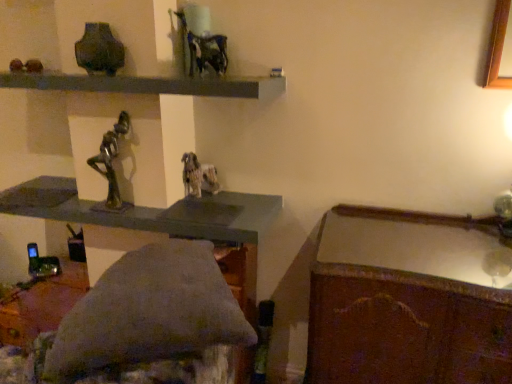
Question: Is smooth gray shelf at upper center facing towards matte dark green vase at upper left?

Choices:
 (A) yes
 (B) no

Answer: (B)

Question: Is smooth gray shelf at upper center taller than matte dark green vase at upper left?

Choices:
 (A) yes
 (B) no

Answer: (B)

Question: From the image's perspective, would you say smooth gray shelf at upper center is positioned over matte dark green vase at upper left?

Choices:
 (A) no
 (B) yes

Answer: (A)

Question: Considering the relative positions of smooth gray shelf at upper center and matte dark green vase at upper left in the image provided, is smooth gray shelf at upper center to the right of matte dark green vase at upper left from the viewer's perspective?

Choices:
 (A) no
 (B) yes

Answer: (B)

Question: Is smooth gray shelf at upper center smaller than matte dark green vase at upper left?

Choices:
 (A) yes
 (B) no

Answer: (B)

Question: Considering their positions, is smooth gray shelf at upper center located in front of or behind bronze statue at center?

Choices:
 (A) behind
 (B) front

Answer: (B)

Question: Is smooth gray shelf at upper center situated inside bronze statue at center or outside?

Choices:
 (A) inside
 (B) outside

Answer: (B)

Question: Considering the positions of point (218, 92) and point (113, 140), is point (218, 92) closer or farther from the camera than point (113, 140)?

Choices:
 (A) closer
 (B) farther

Answer: (A)

Question: From a real-world perspective, is smooth gray shelf at upper center positioned above or below bronze statue at center?

Choices:
 (A) below
 (B) above

Answer: (B)

Question: Considering the positions of point (118, 49) and point (311, 339), is point (118, 49) closer or farther from the camera than point (311, 339)?

Choices:
 (A) closer
 (B) farther

Answer: (B)

Question: Considering their positions, is matte dark green vase at upper left located in front of or behind wooden polished desk at lower right?

Choices:
 (A) front
 (B) behind

Answer: (B)

Question: Would you say matte dark green vase at upper left is to the left or to the right of wooden polished desk at lower right in the picture?

Choices:
 (A) left
 (B) right

Answer: (A)

Question: Looking at their shapes, would you say matte dark green vase at upper left is wider or thinner than wooden polished desk at lower right?

Choices:
 (A) wide
 (B) thin

Answer: (B)

Question: Considering the positions of wooden polished desk at lower right and matte dark green vase at upper left in the image, is wooden polished desk at lower right bigger or smaller than matte dark green vase at upper left?

Choices:
 (A) small
 (B) big

Answer: (B)

Question: In terms of height, does wooden polished desk at lower right look taller or shorter compared to matte dark green vase at upper left?

Choices:
 (A) tall
 (B) short

Answer: (A)